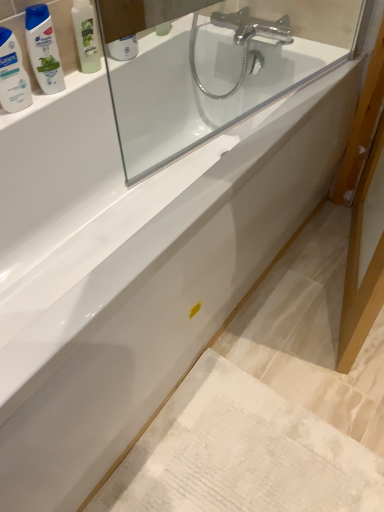
Find the location of a particular element. The height and width of the screenshot is (512, 384). free space in front of green matte shampoo bottle at upper left is located at coordinates (72, 87).